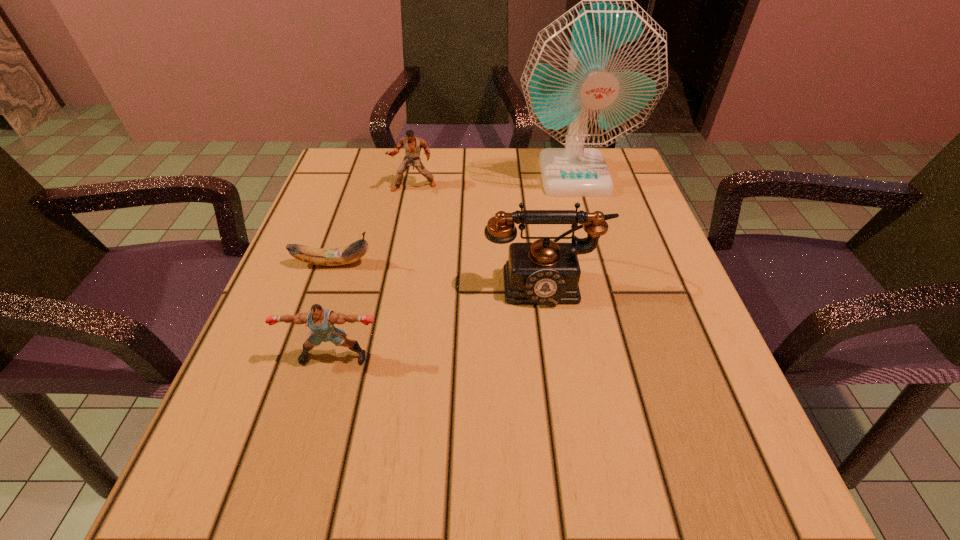
Find the location of `free space that is in between the fourth shortest object and the farther puncher`. free space that is in between the fourth shortest object and the farther puncher is located at coordinates (479, 233).

Where is `free spot between the tallest object and the telephone`? free spot between the tallest object and the telephone is located at coordinates (559, 227).

You are a GUI agent. You are given a task and a screenshot of the screen. Output one action in this format:
    pyautogui.click(x=<x>, y=<y>)
    Task: Click on the blank region between the farther puncher and the nearer puncher
    This screenshot has width=960, height=540.
    Given the screenshot: What is the action you would take?
    pyautogui.click(x=374, y=272)

The image size is (960, 540). In order to click on unoccupied area between the tallest object and the nearest object in this screenshot , I will do 454,266.

Locate an element on the screen. This screenshot has height=540, width=960. blank region between the farther puncher and the fan is located at coordinates (493, 180).

Where is `the third closest object relative to the banana`? the third closest object relative to the banana is located at coordinates (412, 144).

The height and width of the screenshot is (540, 960). I want to click on object that can be found as the fourth closest to the shortest object, so click(594, 75).

You are a GUI agent. You are given a task and a screenshot of the screen. Output one action in this format:
    pyautogui.click(x=<x>, y=<y>)
    Task: Click on the free region that satisfies the following two spatial constraints: 1. in front of the fan to face the airflow; 2. at the stem of the banana
    The height and width of the screenshot is (540, 960).
    Given the screenshot: What is the action you would take?
    pyautogui.click(x=598, y=264)

Identify the location of vacant space that satisfies the following two spatial constraints: 1. in front of the tallest object to face the airflow; 2. at the stem of the banana. The height and width of the screenshot is (540, 960). (598, 264).